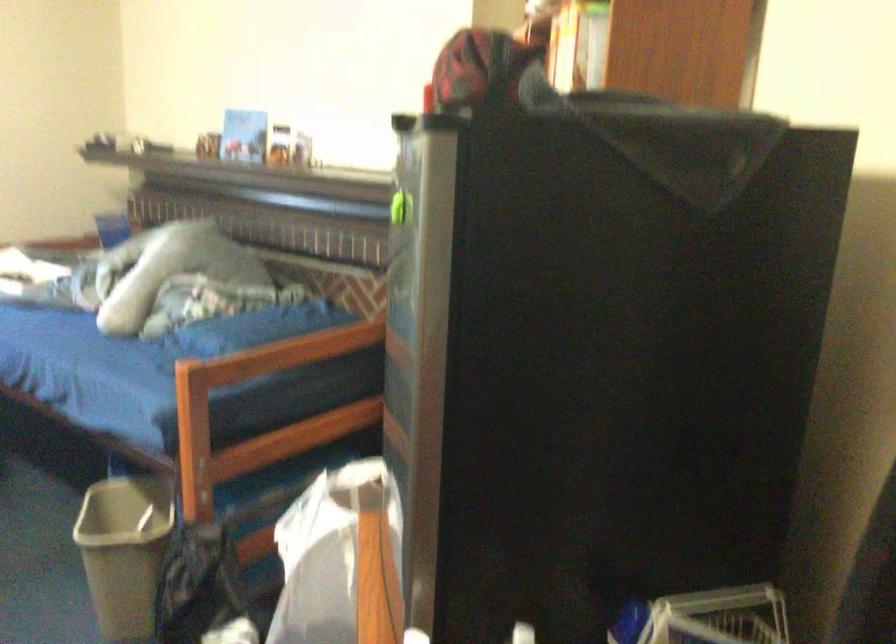
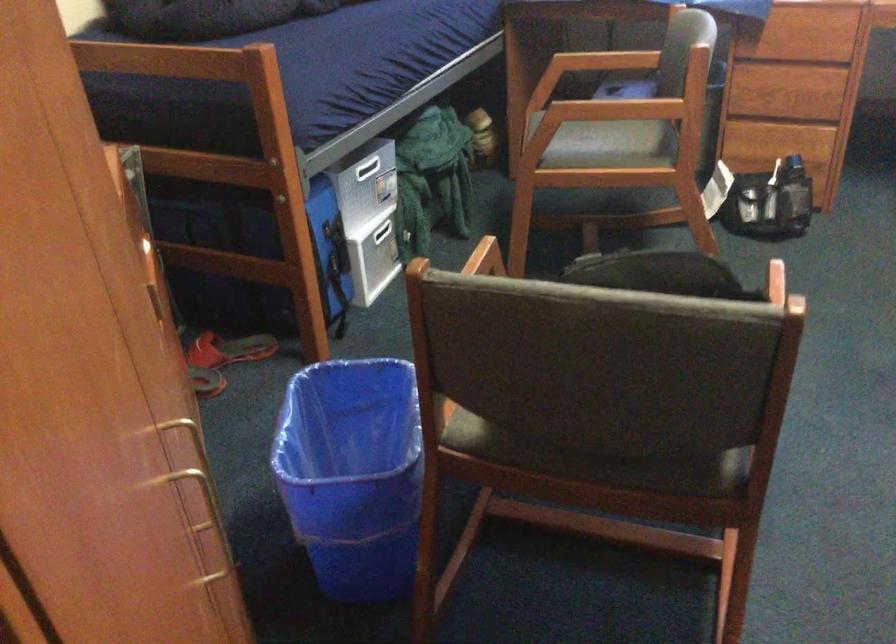
First-person continuous shooting, in which direction is the camera rotating?

The rotation direction of the camera is left-down.